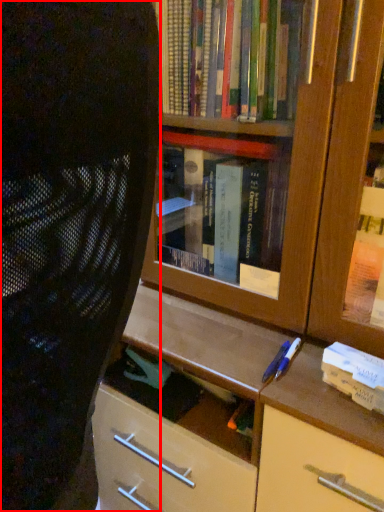
Question: From the image's perspective, where is person (annotated by the red box) located relative to paperback book?

Choices:
 (A) above
 (B) below

Answer: (A)